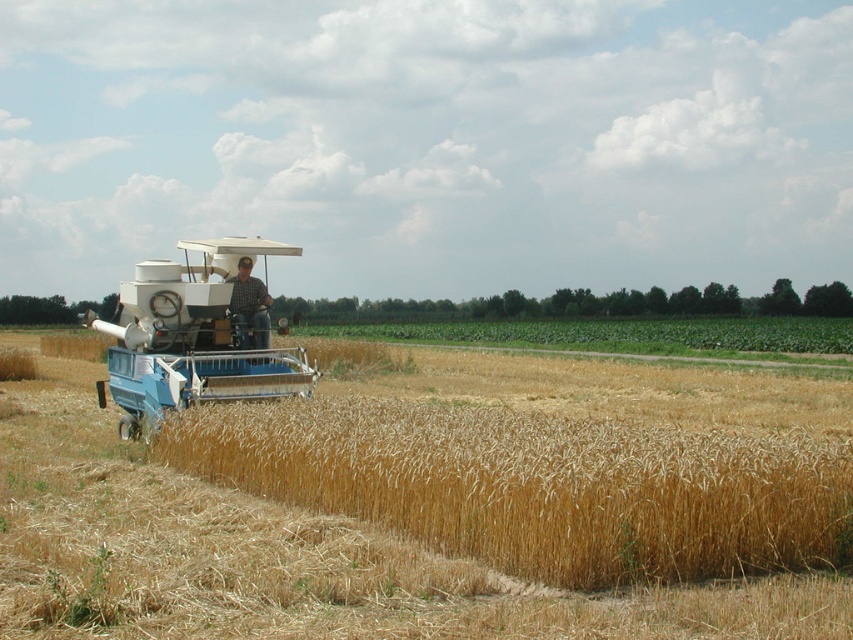
You are a drone operator tasked with capturing aerial footage of the blue metallic combine at center. The drone needs to maintain a safe distance of at least 10 meters from the combine to avoid interference. If the combine is currently at coordinates point 0.525, 0.232, what is the minimum distance the drone should fly from these coordinates to ensure safety?

The blue metallic combine at center is located at point (196,336). To maintain a safe distance of at least 10 meters, the drone should fly at least 10 meters away from these coordinates.

You are a farmer checking the field. You see the golden dry wheat at center and the blue metallic combine at center. Which one is located to the right side of the other?

The golden dry wheat at center is to the right of the blue metallic combine at center.